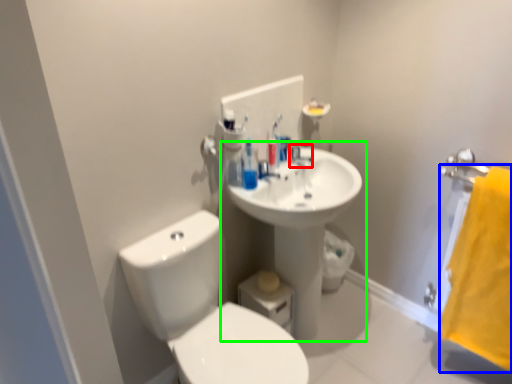
Question: Based on their relative distances, which object is nearer to plumbing fixture (highlighted by a red box)? Choose from beach towel (highlighted by a blue box) and sink (highlighted by a green box).

Choices:
 (A) beach towel
 (B) sink

Answer: (B)